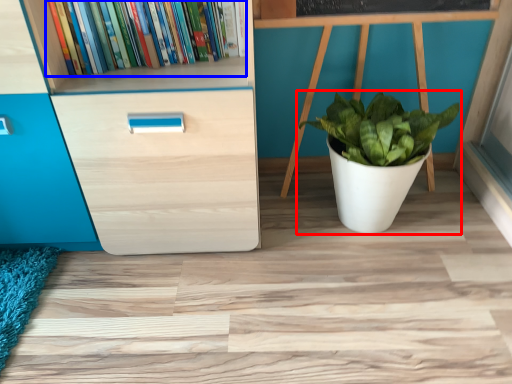
Question: Which point is further to the camera, houseplant (highlighted by a red box) or book (highlighted by a blue box)?

Choices:
 (A) houseplant
 (B) book

Answer: (A)